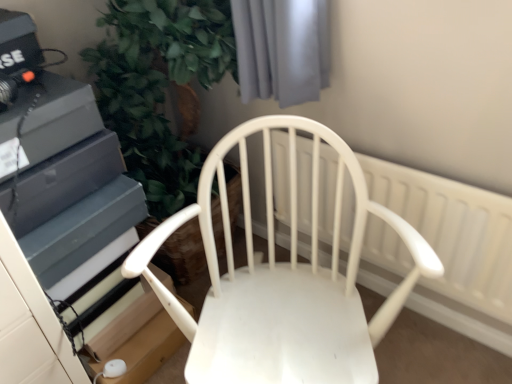
The image size is (512, 384). What do you see at coordinates (454, 247) in the screenshot?
I see `white plastic radiator at center` at bounding box center [454, 247].

The height and width of the screenshot is (384, 512). Find the location of `white plastic radiator at center`. white plastic radiator at center is located at coordinates (454, 247).

Describe the element at coordinates (283, 279) in the screenshot. This screenshot has width=512, height=384. I see `white matte chair at center` at that location.

Where is `white matte chair at center`? The image size is (512, 384). white matte chair at center is located at coordinates (283, 279).

I want to click on white plastic radiator at center, so click(454, 247).

Based on their positions, is white plastic radiator at center located to the left or right of white matte chair at center?

white plastic radiator at center is to the right of white matte chair at center.

Is white plastic radiator at center behind white matte chair at center?

Yes, the depth of white plastic radiator at center is greater than that of white matte chair at center.

Considering the positions of point (474, 253) and point (340, 348), is point (474, 253) closer or farther from the camera than point (340, 348)?

Point (474, 253).

From the image's perspective, is white plastic radiator at center over white matte chair at center?

Yes, from the image's perspective, white plastic radiator at center is over white matte chair at center.

From a real-world perspective, which is physically below, white plastic radiator at center or white matte chair at center?

In real-world perspective, white plastic radiator at center is lower.

In terms of width, does white plastic radiator at center look wider or thinner when compared to white matte chair at center?

In the image, white plastic radiator at center appears to be more narrow than white matte chair at center.

Can you confirm if white plastic radiator at center is taller than white matte chair at center?

No.

Considering the sizes of objects white plastic radiator at center and white matte chair at center in the image provided, who is bigger, white plastic radiator at center or white matte chair at center?

white matte chair at center is bigger.

From the picture: Is white plastic radiator at center not within white matte chair at center?

Absolutely, white plastic radiator at center is external to white matte chair at center.

Is white plastic radiator at center placed right next to white matte chair at center?

No, white plastic radiator at center is not making contact with white matte chair at center.

Is white plastic radiator at center positioned with its back to white matte chair at center?

Yes, white matte chair at center is at the back of white plastic radiator at center.

How many degrees apart are the facing directions of white plastic radiator at center and white matte chair at center?

white plastic radiator at center and white matte chair at center are facing 33.4 degrees away from each other.

Locate an element on the screen. Image resolution: width=512 pixels, height=384 pixels. chair in front of the white plastic radiator at center is located at coordinates (283, 279).

Looking at this image, can you confirm if white matte chair at center is positioned to the left of white plastic radiator at center?

Correct, you'll find white matte chair at center to the left of white plastic radiator at center.

Which object is further away from the camera, white matte chair at center or white plastic radiator at center?

white plastic radiator at center is behind.

Considering the points (248, 341) and (507, 249), which point is in front, point (248, 341) or point (507, 249)?

The point (248, 341) is in front.

From the image's perspective, is white matte chair at center positioned above or below white plastic radiator at center?

white matte chair at center is situated lower than white plastic radiator at center in the image.

From a real-world perspective, is white matte chair at center over white plastic radiator at center?

Yes.

Between white matte chair at center and white plastic radiator at center, which one has smaller width?

With smaller width is white plastic radiator at center.

Which of these two, white matte chair at center or white plastic radiator at center, stands taller?

white matte chair at center is taller.

Considering the relative sizes of white matte chair at center and white plastic radiator at center in the image provided, is white matte chair at center bigger than white plastic radiator at center?

Yes, white matte chair at center is bigger than white plastic radiator at center.

Is white matte chair at center outside of white plastic radiator at center?

white matte chair at center lies outside white plastic radiator at center's area.

Looking at this image, are white matte chair at center and white plastic radiator at center located far from each other?

No, white matte chair at center is in close proximity to white plastic radiator at center.

Is white matte chair at center facing away from white plastic radiator at center?

That's right, white matte chair at center is facing away from white plastic radiator at center.

Measure the distance between white matte chair at center and white plastic radiator at center.

9.78 inches.

The width and height of the screenshot is (512, 384). Identify the location of radiator located on the right of white matte chair at center. (454, 247).

Where is `chair that appears above the white plastic radiator at center (from a real-world perspective)`? The height and width of the screenshot is (384, 512). chair that appears above the white plastic radiator at center (from a real-world perspective) is located at coordinates (283, 279).

The image size is (512, 384). I want to click on radiator that appears below the white matte chair at center (from a real-world perspective), so click(x=454, y=247).